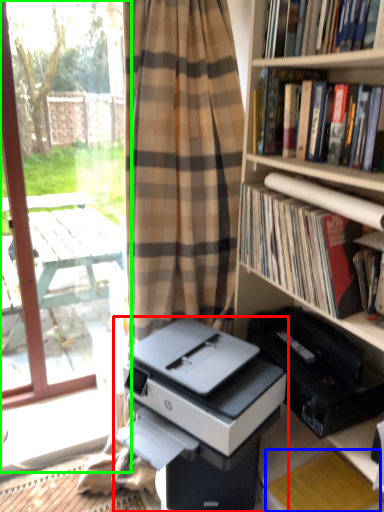
Question: Estimate the real-world distances between objects in this image. Which object is farther from printer (highlighted by a red box), paperback book (highlighted by a blue box) or screen door (highlighted by a green box)?

Choices:
 (A) paperback book
 (B) screen door

Answer: (B)